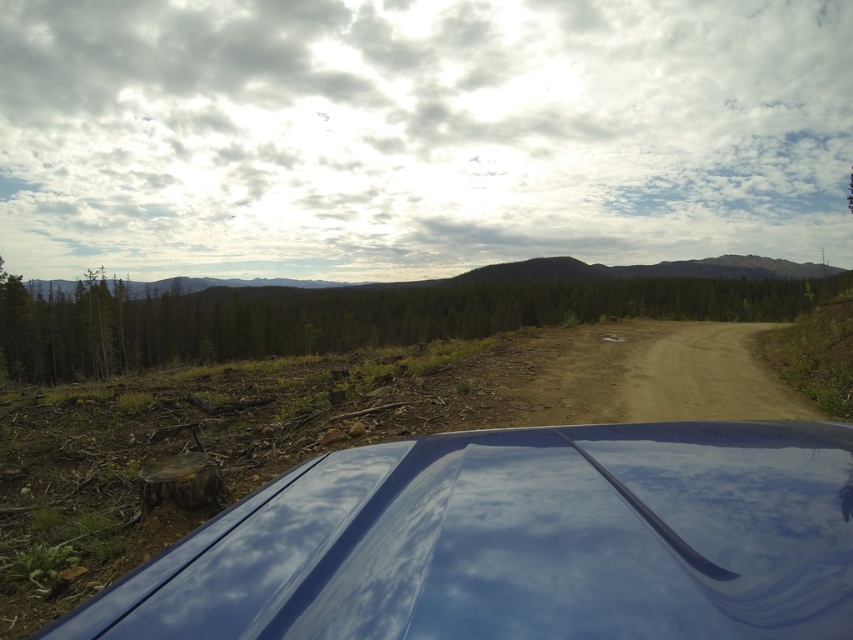
Question: Is glossy blue car at lower center positioned behind green matte tree at center?

Choices:
 (A) no
 (B) yes

Answer: (A)

Question: Does glossy blue car at lower center appear over green matte tree at center?

Choices:
 (A) no
 (B) yes

Answer: (A)

Question: Which point is closer to the camera?

Choices:
 (A) (326, 580)
 (B) (202, 324)

Answer: (A)

Question: Which of the following is the farthest from the observer?

Choices:
 (A) glossy blue car at lower center
 (B) green matte tree at center

Answer: (B)

Question: Can you confirm if glossy blue car at lower center is smaller than green matte tree at center?

Choices:
 (A) yes
 (B) no

Answer: (A)

Question: Among these objects, which one is farthest from the camera?

Choices:
 (A) glossy blue car at lower center
 (B) green matte tree at center

Answer: (B)